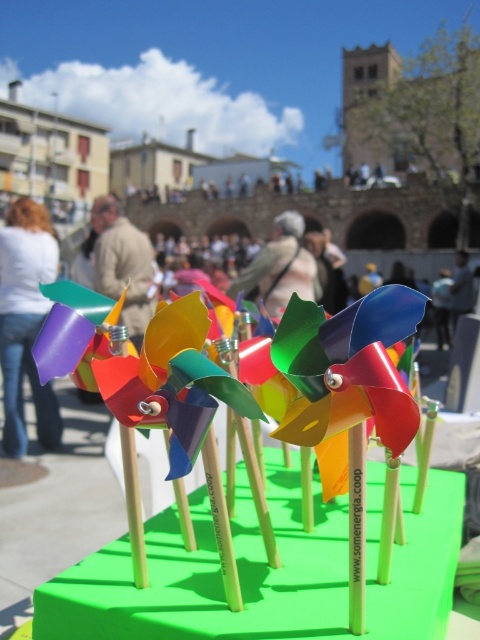
Can you confirm if green matte table at center is taller than matte purple tie at left?

No.

Which is behind, point (348, 634) or point (40, 435)?

The point (40, 435) is behind.

Image resolution: width=480 pixels, height=640 pixels. What do you see at coordinates (267, 570) in the screenshot?
I see `green matte table at center` at bounding box center [267, 570].

The height and width of the screenshot is (640, 480). What are the coordinates of `green matte table at center` in the screenshot? It's located at (267, 570).

Does point (10, 442) lie in front of point (134, 260)?

Yes, point (10, 442) is closer to viewer.

Does matte purple tie at left appear under light brown leather jacket at center?

Correct, matte purple tie at left is located below light brown leather jacket at center.

Is point (35, 301) positioned in front of point (112, 243)?

That is True.

Locate an element on the screen. matte purple tie at left is located at coordinates (25, 321).

Does matte purple tie at left appear under light beige fabric at center?

Indeed, matte purple tie at left is positioned under light beige fabric at center.

Image resolution: width=480 pixels, height=640 pixels. What do you see at coordinates (25, 321) in the screenshot?
I see `matte purple tie at left` at bounding box center [25, 321].

Measure the distance between point (15, 349) and camera.

Point (15, 349) is 12.57 feet away from camera.

Locate an element on the screen. matte purple tie at left is located at coordinates (25, 321).